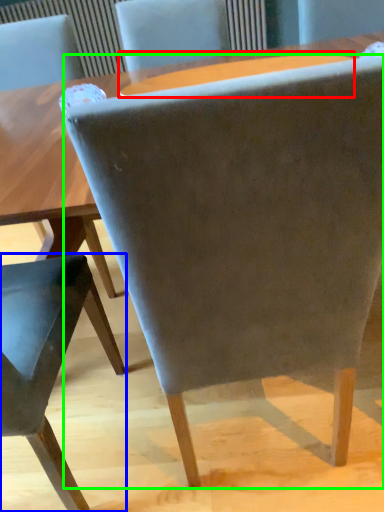
Question: Considering the real-world distances, which object is farthest from round table (highlighted by a red box)? chair (highlighted by a blue box) or chair (highlighted by a green box)?

Choices:
 (A) chair
 (B) chair

Answer: (B)